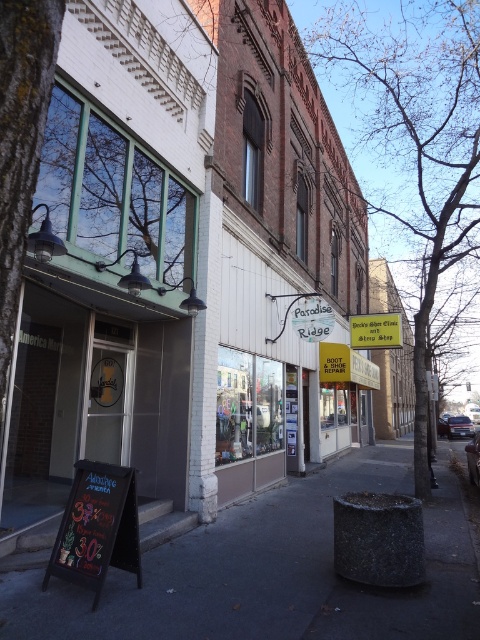
You are a delivery person trying to park your bike. You see the dark asphalt pavement at center and the chalkboard sign at lower left. Which one is taller?

The dark asphalt pavement at center is much taller than the chalkboard sign at lower left according to the description.

You are standing on the sidewalk in front of the America Mart. You see a point marked at coordinates (272, 572). What is located at that point?

The dark asphalt pavement at center is located at point (272, 572).

You are standing on the sidewalk in front of the buildings. You need to cross the street to reach the other side. The traffic light is 2 meters away from you. Is the dark asphalt pavement at center far enough for you to safely wait while waiting for the traffic light to turn green?

The dark asphalt pavement at center is 3.42 meters away from the viewer. Since the traffic light is only 2 meters away, the pavement is farther than needed. You should move closer to the traffic light to wait safely.